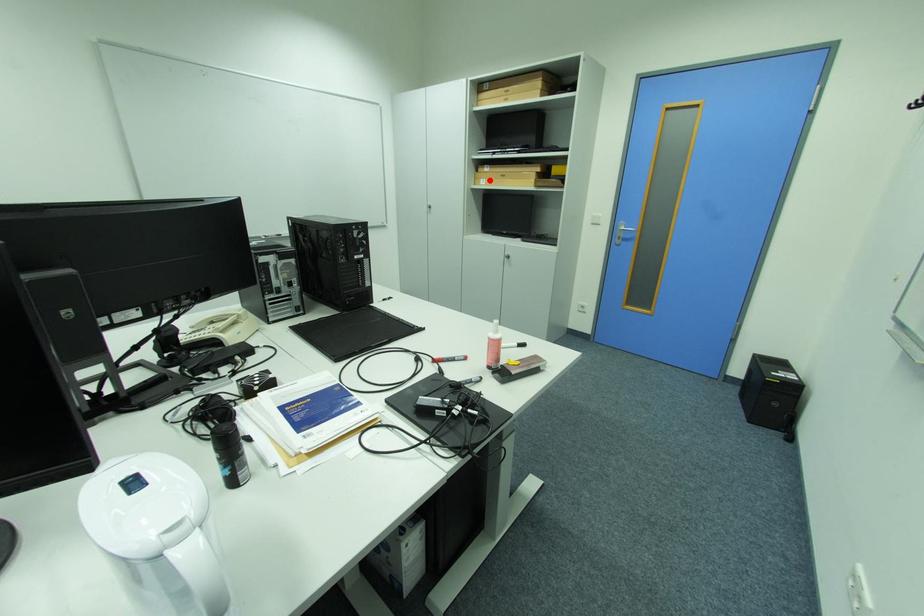
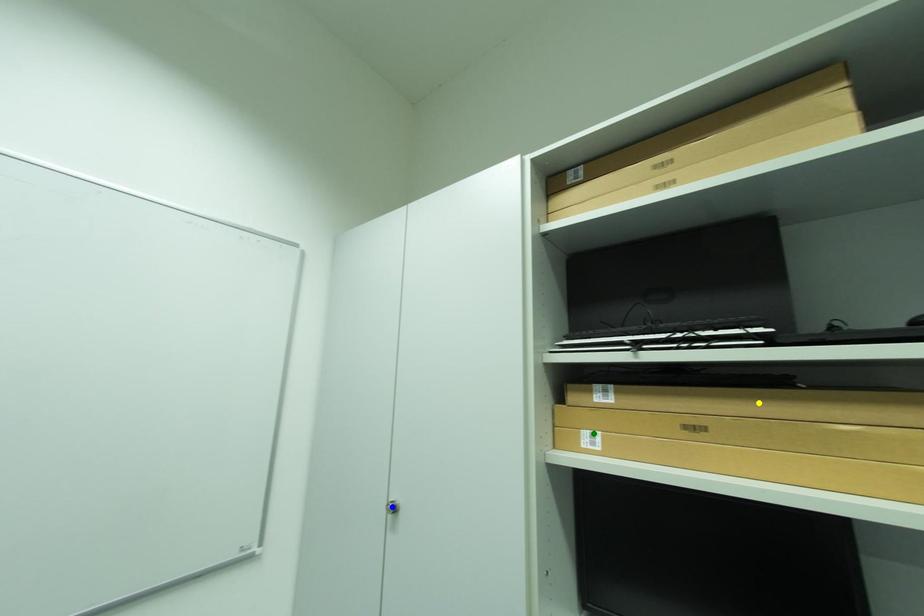
Question: I am providing you with two images of the same scene from different viewpoints. A red point is marked on the first image. You are given multiple points on the second image. Which point in image 2 is actually the same real-world point as the red point in image 1?

Choices:
 (A) green point
 (B) yellow point
 (C) blue point

Answer: (A)